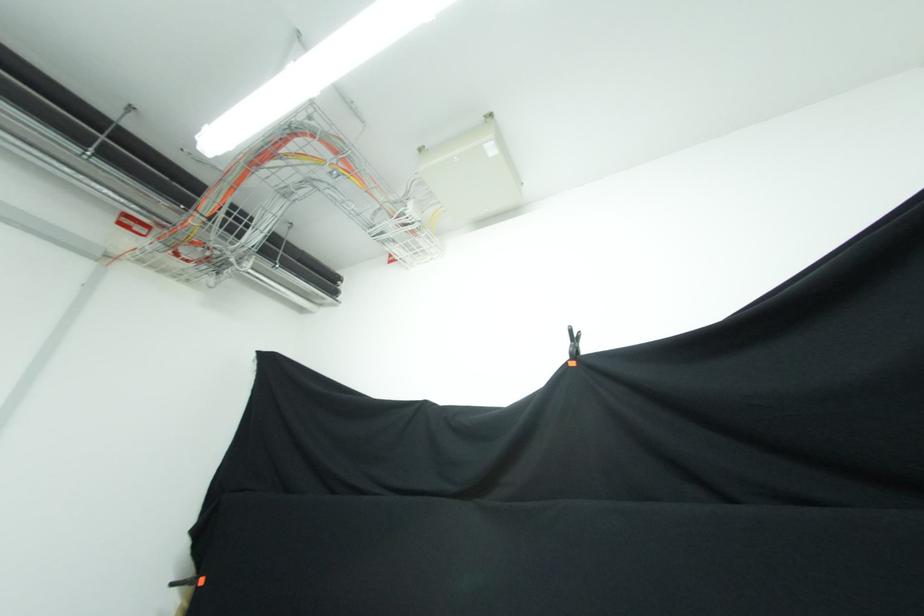
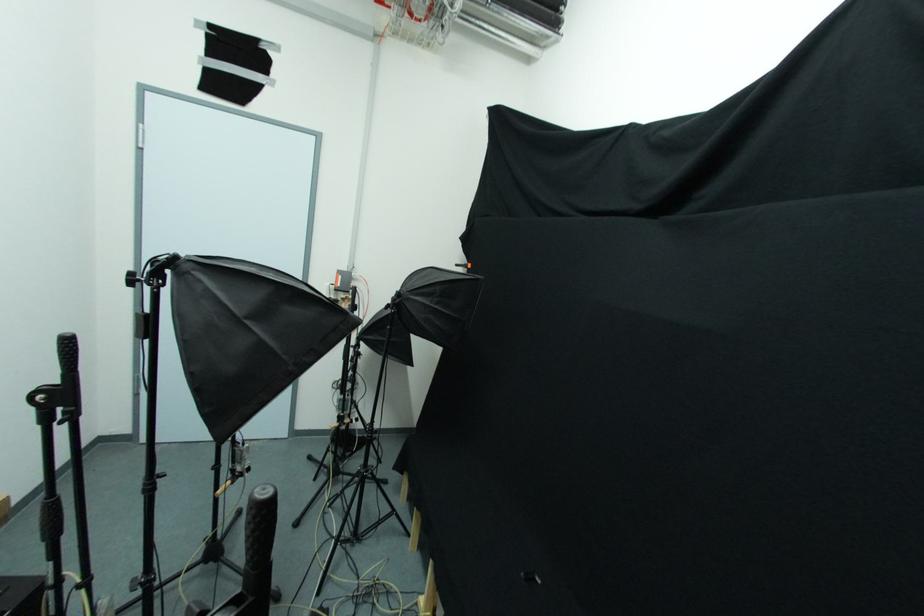
First-person continuous shooting, in which direction is the camera rotating?

The camera's rotation is toward left-down.